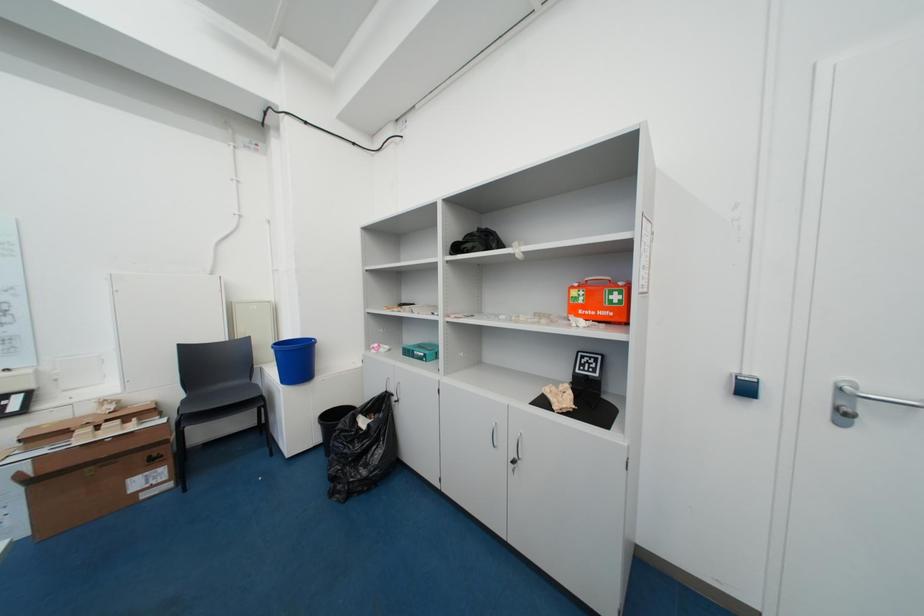
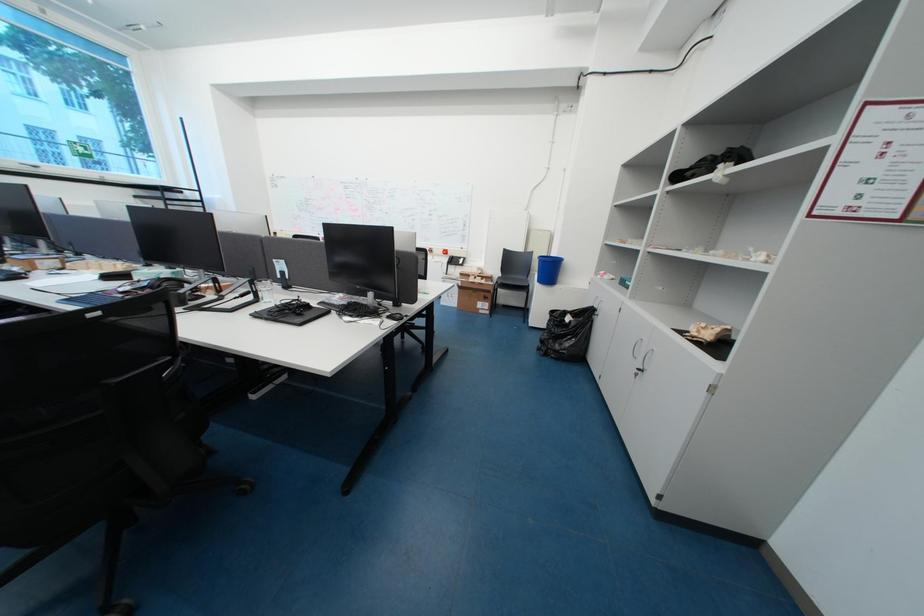
From the picture: How did the camera likely rotate?

The rotation direction of the camera is left-down.